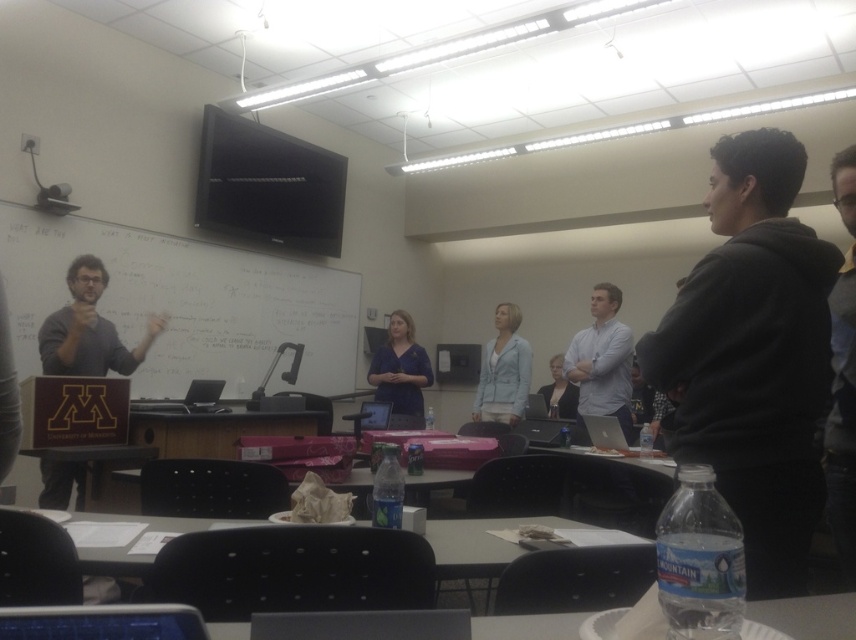
Question: Which object is positioned farthest from the wooden table at center?

Choices:
 (A) light gray sweater at center
 (B) whiteboard at upper center

Answer: (A)

Question: Which of these objects is positioned closest to the whiteboard at upper center?

Choices:
 (A) matte blue shirt at center
 (B) wooden table at center

Answer: (A)

Question: Which object is closer to the camera taking this photo?

Choices:
 (A) clear plastic table at lower center
 (B) wooden table at center
 (C) whiteboard at upper center

Answer: (A)

Question: Is wooden table at center further to the viewer compared to light gray sweater at center?

Choices:
 (A) no
 (B) yes

Answer: (A)

Question: Where is dark gray sweater at left located in relation to light blue fabric jacket at center in the image?

Choices:
 (A) left
 (B) right

Answer: (A)

Question: Is dark gray sweater at left to the right of light blue shirt at center from the viewer's perspective?

Choices:
 (A) yes
 (B) no

Answer: (B)